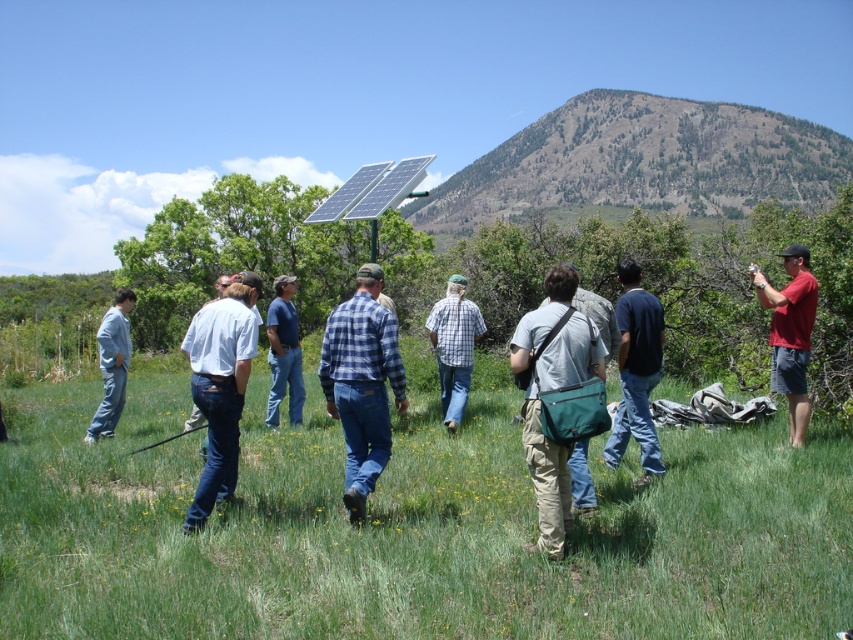
You are a photographer trying to capture a landscape shot. You have two options for your composition focusing on the green grassy at center and the green textured hillside at upper center. Which object should you focus on if you want to highlight something taller in the scene?

The green textured hillside at upper center is taller than the green grassy at center, so focusing on the green textured hillside at upper center would highlight the taller object in the scene.